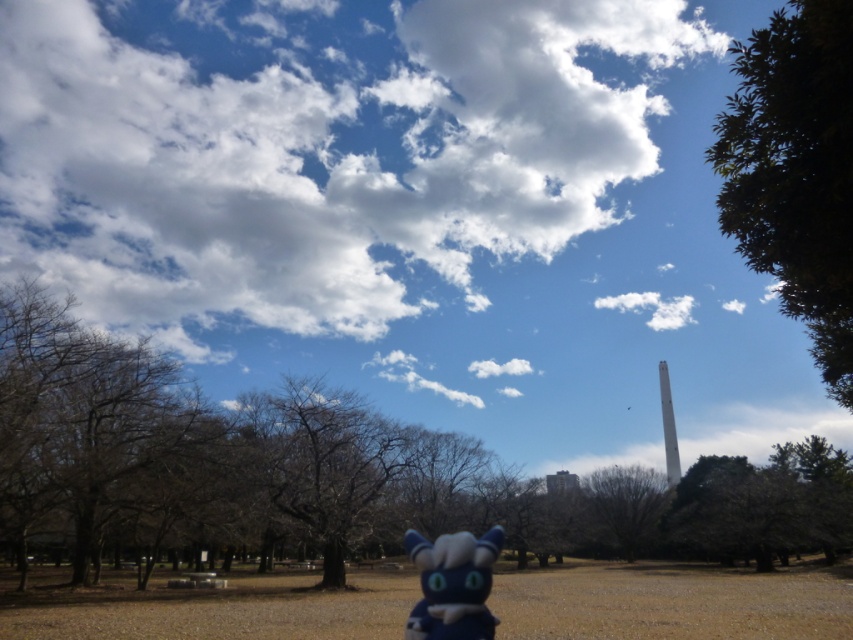
Question: Which point appears farthest from the camera in this image?

Choices:
 (A) (795, 65)
 (B) (463, 260)
 (C) (567, 506)

Answer: (B)

Question: Considering the relative positions of blue plush toy at center and brown leafless tree at center in the image provided, where is blue plush toy at center located with respect to brown leafless tree at center?

Choices:
 (A) left
 (B) right

Answer: (A)

Question: Which point appears farthest from the camera in this image?

Choices:
 (A) (x=793, y=509)
 (B) (x=469, y=532)
 (C) (x=138, y=108)
 (D) (x=747, y=38)

Answer: (D)

Question: Estimate the real-world distances between objects in this image. Which object is closer to the brown leafless tree at lower left?

Choices:
 (A) white fluffy cloud at upper center
 (B) blue plush toy at center
 (C) green leafy tree at upper right

Answer: (A)

Question: Is brown leafless tree at lower left to the left of green leafy tree at upper right from the viewer's perspective?

Choices:
 (A) yes
 (B) no

Answer: (A)

Question: Is brown leafless tree at lower left bigger than green leafy tree at upper right?

Choices:
 (A) yes
 (B) no

Answer: (B)